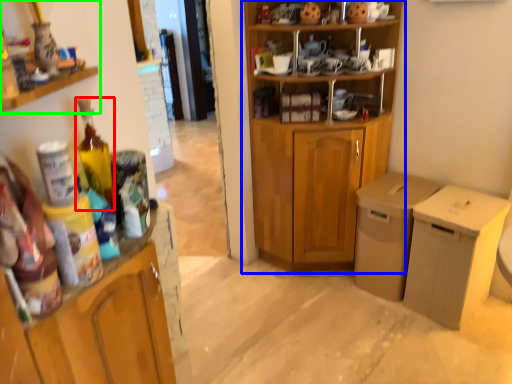
Question: Which object is positioned closest to bottle (highlighted by a red box)? Select from cupboard (highlighted by a blue box) and cabinetry (highlighted by a green box).

Choices:
 (A) cupboard
 (B) cabinetry

Answer: (B)